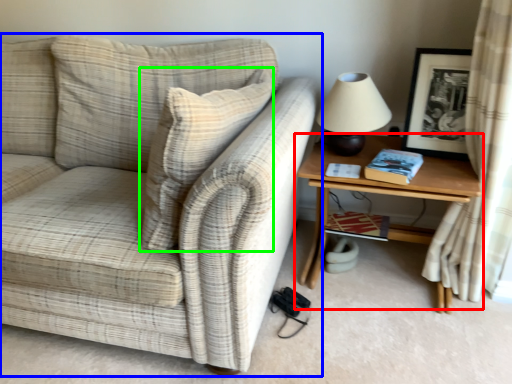
Question: Estimate the real-world distances between objects in this image. Which object is closer to table (highlighted by a red box), studio couch (highlighted by a blue box) or throw pillow (highlighted by a green box)?

Choices:
 (A) studio couch
 (B) throw pillow

Answer: (B)